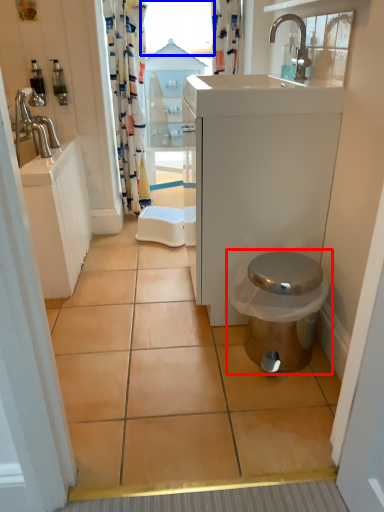
Question: Which point is further to the camera, toilet (highlighted by a red box) or window screen (highlighted by a blue box)?

Choices:
 (A) toilet
 (B) window screen

Answer: (B)